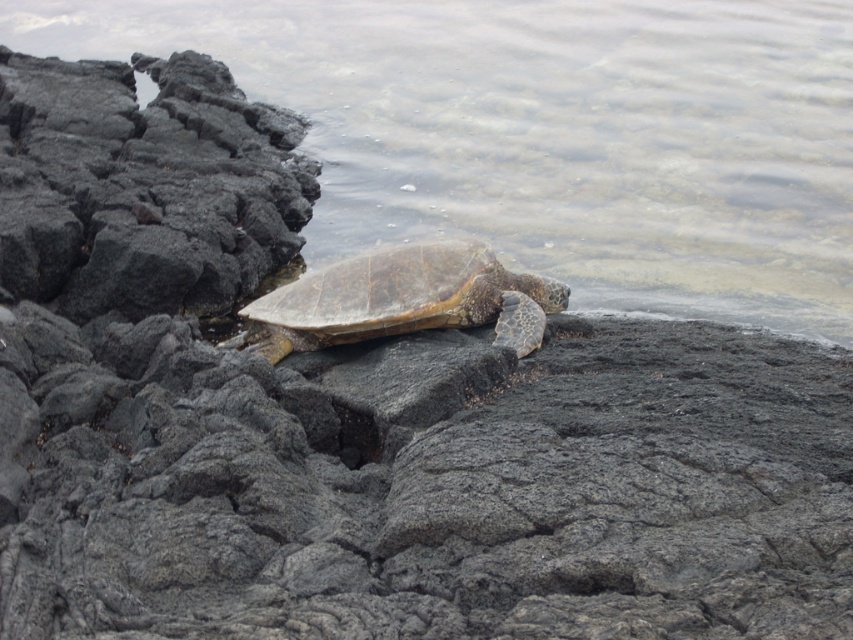
Question: Where is clear water at upper center located in relation to brown textured shell at center in the image?

Choices:
 (A) left
 (B) right

Answer: (B)

Question: Does clear water at upper center come in front of brown textured shell at center?

Choices:
 (A) no
 (B) yes

Answer: (A)

Question: Where is clear water at upper center located in relation to brown textured shell at center in the image?

Choices:
 (A) below
 (B) above

Answer: (B)

Question: Which object is closer to the camera taking this photo?

Choices:
 (A) brown textured shell at center
 (B) clear water at upper center

Answer: (A)

Question: Which point is closer to the camera taking this photo?

Choices:
 (A) (479, 316)
 (B) (502, 4)

Answer: (A)